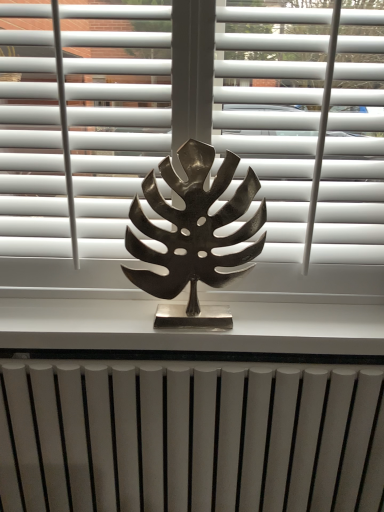
Question: Should I look upward or downward to see metallic silver at center?

Choices:
 (A) down
 (B) up

Answer: (A)

Question: Can you confirm if metallic silver leaf at center is positioned to the right of white matte blind at upper center?

Choices:
 (A) yes
 (B) no

Answer: (B)

Question: From the image's perspective, would you say metallic silver leaf at center is positioned over white matte blind at upper center?

Choices:
 (A) yes
 (B) no

Answer: (B)

Question: Considering the relative positions of metallic silver leaf at center and white matte blind at upper center in the image provided, is metallic silver leaf at center to the left of white matte blind at upper center from the viewer's perspective?

Choices:
 (A) no
 (B) yes

Answer: (B)

Question: Would you say metallic silver leaf at center is a long distance from white matte blind at upper center?

Choices:
 (A) yes
 (B) no

Answer: (B)

Question: Does metallic silver leaf at center turn towards white matte blind at upper center?

Choices:
 (A) no
 (B) yes

Answer: (B)

Question: From a real-world perspective, is metallic silver leaf at center under white matte blind at upper center?

Choices:
 (A) no
 (B) yes

Answer: (B)

Question: Is bronze leaf at center at the back of metallic silver leaf at center?

Choices:
 (A) no
 (B) yes

Answer: (B)

Question: From a real-world perspective, is metallic silver leaf at center positioned under bronze leaf at center based on gravity?

Choices:
 (A) yes
 (B) no

Answer: (B)

Question: Does metallic silver leaf at center have a lesser width compared to bronze leaf at center?

Choices:
 (A) no
 (B) yes

Answer: (B)

Question: Does metallic silver leaf at center have a larger size compared to bronze leaf at center?

Choices:
 (A) no
 (B) yes

Answer: (B)

Question: Can you confirm if metallic silver leaf at center is shorter than bronze leaf at center?

Choices:
 (A) yes
 (B) no

Answer: (B)

Question: Could bronze leaf at center be considered to be inside metallic silver leaf at center?

Choices:
 (A) yes
 (B) no

Answer: (B)

Question: Considering the relative sizes of white matte radiator at bottom and metallic silver leaf at center in the image provided, is white matte radiator at bottom thinner than metallic silver leaf at center?

Choices:
 (A) no
 (B) yes

Answer: (A)